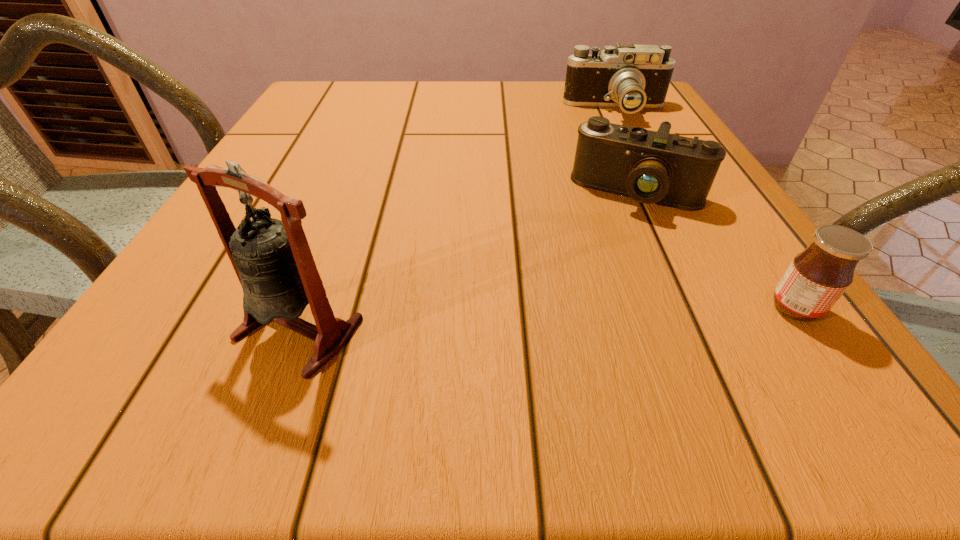
At what (x,y) coordinates should I click in order to perform the action: click on free spot on the desktop that is between the leftmost object and the jam and is positioned at the lens of the farthest object. Please return your answer as a coordinate pair (x, y). This screenshot has height=540, width=960. Looking at the image, I should click on (615, 316).

I want to click on vacant space on the desktop that is between the tallest object and the jam and is positioned on the lens of the nearer camera, so (x=591, y=317).